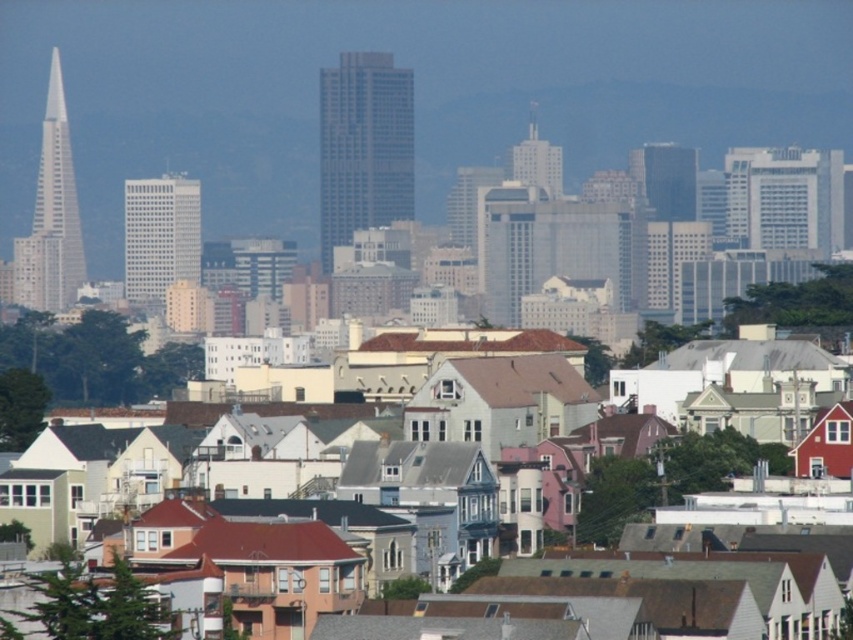
Who is more distant from viewer, (370, 216) or (65, 180)?

Positioned behind is point (65, 180).

Is smooth glass skyscraper at center to the right of white glass spire at left from the viewer's perspective?

Yes, smooth glass skyscraper at center is to the right of white glass spire at left.

What do you see at coordinates (363, 147) in the screenshot?
I see `smooth glass skyscraper at center` at bounding box center [363, 147].

This screenshot has width=853, height=640. I want to click on smooth glass skyscraper at center, so click(363, 147).